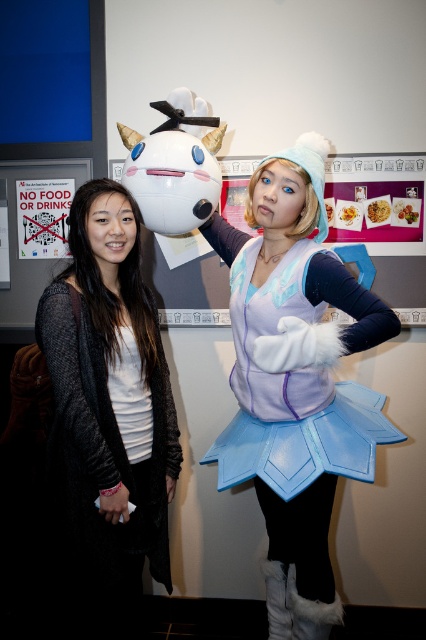
You are a photographer at a convention and need to capture both the black knit cardigan at left and the purple vest costume at right in a single shot. Given that your camera has a maximum focus range of 5 feet, will you be able to include both subjects in focus?

The black knit cardigan at left and the purple vest costume at right are 4.72 feet apart, so yes, the photographer can capture both subjects in focus since the distance between them is within the camera maximum focus range of 5 feet.

You are a photographer standing at the camera position. You want to adjust the focus to capture the matte purple vest at center clearly. What is the minimum distance you should set the focus to ensure the vest is in focus?

The minimum focus distance should be set to 1.22 meters to ensure the matte purple vest at center is in focus since it is exactly that distance away from the camera.